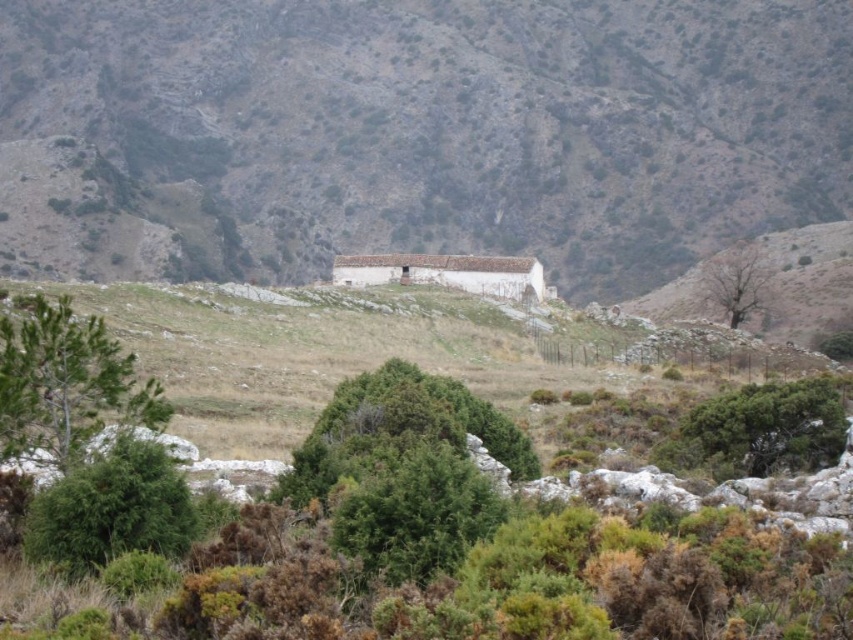
You are standing at the base of the hill where the isolated building is located. You see a green leafy tree at center and a green leafy shrub at center. Which one is closer to you?

The green leafy tree at center is in front of the green leafy shrub at center, so it is closer to you.

You are standing in the rural landscape and want to walk from the green leafy tree at left to the brown rocky mountain at center. Which direction should you head?

You should head to the right because the brown rocky mountain at center is to the right of the green leafy tree at left.